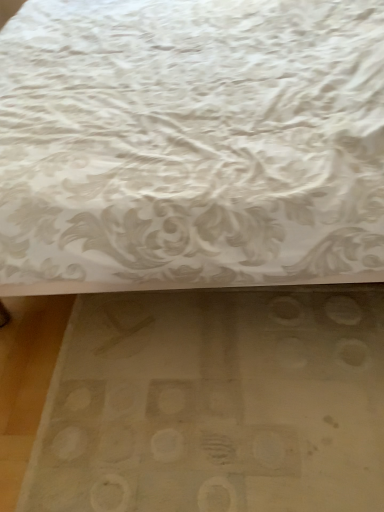
Question: From a real-world perspective, is white textured fabric at upper center positioned above or below white matte mat at lower center?

Choices:
 (A) below
 (B) above

Answer: (B)

Question: In the image, is white textured fabric at upper center positioned in front of or behind white matte mat at lower center?

Choices:
 (A) front
 (B) behind

Answer: (A)

Question: Is point (3, 237) closer or farther from the camera than point (355, 502)?

Choices:
 (A) closer
 (B) farther

Answer: (B)

Question: In terms of width, does white matte mat at lower center look wider or thinner when compared to white textured fabric at upper center?

Choices:
 (A) thin
 (B) wide

Answer: (A)

Question: Visually, is white matte mat at lower center positioned to the left or to the right of white textured fabric at upper center?

Choices:
 (A) left
 (B) right

Answer: (B)

Question: Is point (284, 347) closer or farther from the camera than point (311, 115)?

Choices:
 (A) closer
 (B) farther

Answer: (B)

Question: Choose the correct answer: Is white matte mat at lower center inside white textured fabric at upper center or outside it?

Choices:
 (A) inside
 (B) outside

Answer: (A)